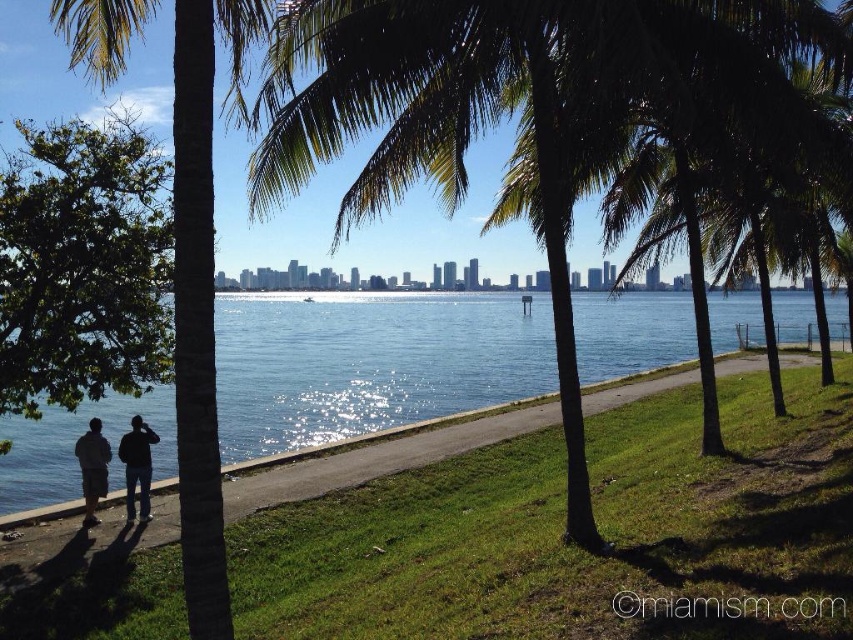
You are standing at the center of the paved pathway in the waterfront scene. Looking towards the green leafy palm tree at center, which direction should you face to see it clearly?

The green leafy palm tree at center is located at point [531,108], so you should face towards the left side since the palm trees dominate the left side of the frame as mentioned in the scene description.